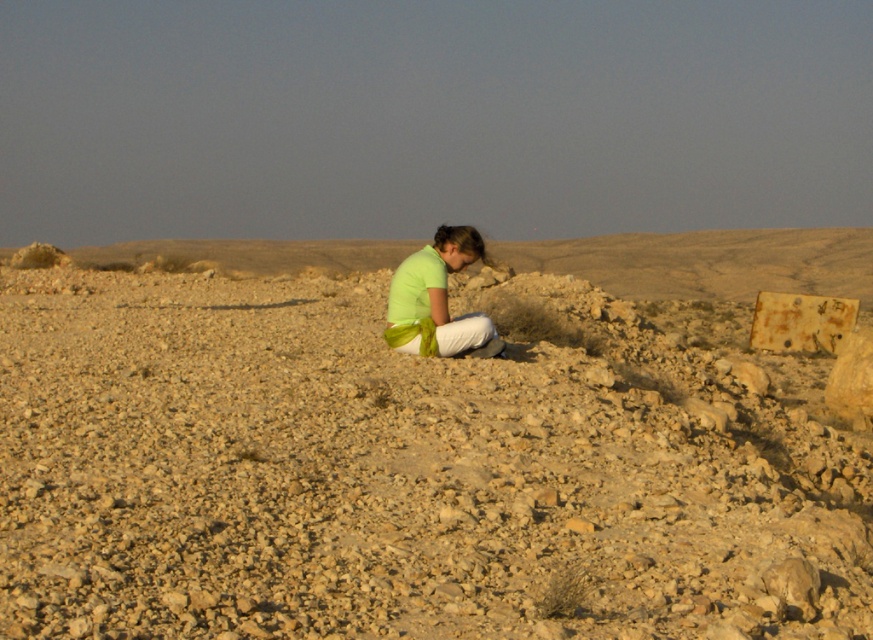
You are a hiker who wants to take a break. You see the brown rocky dirt at center and the green matte shirt at center. Which surface would be more comfortable to sit on?

The green matte shirt at center is more comfortable to sit on because the brown rocky dirt at center is positioned over it, indicating the shirt is underneath and possibly softer.

You are a hiker carrying a backpack that is 1.5 meters wide. You want to place your backpack between the brown rocky dirt at center and the green matte shirt at center. Is there enough space for the backpack?

The distance between the brown rocky dirt at center and the green matte shirt at center is 1.85 meters. Since the backpack is 1.5 meters wide, there is enough space to place it between them.